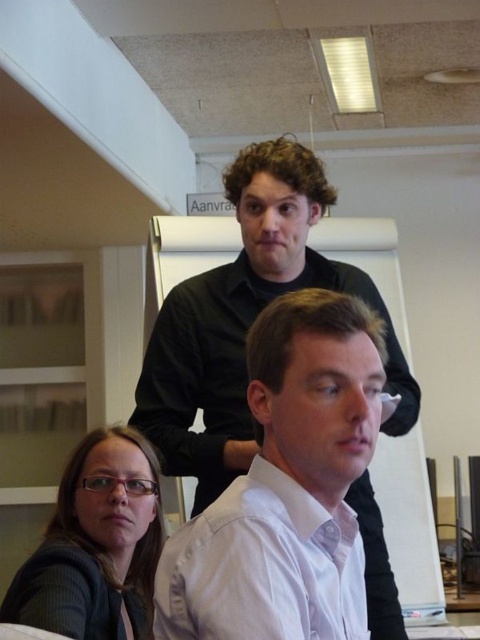
Question: Does black matte shirt at upper center come in front of matte black glasses at lower left?

Choices:
 (A) yes
 (B) no

Answer: (B)

Question: Can you confirm if black matte shirt at upper center is wider than matte black glasses at lower left?

Choices:
 (A) no
 (B) yes

Answer: (B)

Question: Can you confirm if black matte shirt at upper center is thinner than matte black glasses at lower left?

Choices:
 (A) no
 (B) yes

Answer: (A)

Question: Which object is farther from the camera taking this photo?

Choices:
 (A) matte black glasses at lower left
 (B) black matte shirt at upper center

Answer: (B)

Question: Which point appears farthest from the camera in this image?

Choices:
 (A) (88, 579)
 (B) (160, 317)

Answer: (B)